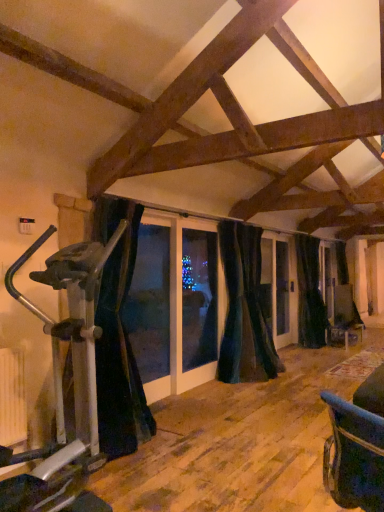
The width and height of the screenshot is (384, 512). In order to click on dark velvet curtain at center, which is the second curtain from right to left in this screenshot , I will do `click(244, 309)`.

What do you see at coordinates (61, 384) in the screenshot? Image resolution: width=384 pixels, height=512 pixels. I see `silver metallic stationary bicycle at left` at bounding box center [61, 384].

At what (x,y) coordinates should I click in order to perform the action: click on black velvet curtain at right, the first curtain from the right. Please return your answer as a coordinate pair (x, y). This screenshot has width=384, height=512. Looking at the image, I should click on (310, 294).

Does point (44, 473) come behind point (250, 312)?

No, (44, 473) is in front of (250, 312).

Is silver metallic stationary bicycle at left taller than dark velvet curtain at center, the second curtain viewed from the left?

In fact, silver metallic stationary bicycle at left may be shorter than dark velvet curtain at center, the second curtain viewed from the left.

From a real-world perspective, which object stands above the other?

dark velvet curtain at center, the second curtain viewed from the left, is physically above.

From the image's perspective, is silver metallic stationary bicycle at left above dark velvet curtain at center, which is the second curtain from right to left?

No, from the image's perspective, silver metallic stationary bicycle at left is not above dark velvet curtain at center, which is the second curtain from right to left.

I want to click on the 1st curtain in front of the black velvet curtain at right, the first curtain from the right, counting from the anchor's position, so click(x=244, y=309).

Can you confirm if dark velvet curtain at center, the second curtain in the back-to-front sequence, is taller than black velvet curtain at right, the 3th curtain positioned from the left?

In fact, dark velvet curtain at center, the second curtain in the back-to-front sequence, may be shorter than black velvet curtain at right, the 3th curtain positioned from the left.

Which object is wider, dark velvet curtain at center, the second curtain in the back-to-front sequence, or black velvet curtain at right, the first curtain from the right?

With larger width is dark velvet curtain at center, the second curtain in the back-to-front sequence.

Is dark velvet curtain at center, which is the second curtain from right to left, in front of or behind black velvet curtain at right, the 3th curtain positioned from the left, in the image?

Clearly, dark velvet curtain at center, which is the second curtain from right to left, is in front of black velvet curtain at right, the 3th curtain positioned from the left.

Is dark velvet curtain at center, the second curtain viewed from the front, at the left side of black fabric curtain at left, positioned as the third curtain in right-to-left order?

Incorrect, dark velvet curtain at center, the second curtain viewed from the front, is not on the left side of black fabric curtain at left, positioned as the third curtain in right-to-left order.

In terms of height, does dark velvet curtain at center, the second curtain in the back-to-front sequence, look taller or shorter compared to black fabric curtain at left, positioned as the third curtain in right-to-left order?

In the image, dark velvet curtain at center, the second curtain in the back-to-front sequence, appears to be shorter than black fabric curtain at left, positioned as the third curtain in right-to-left order.

In terms of width, does dark velvet curtain at center, the second curtain viewed from the left, look wider or thinner when compared to black fabric curtain at left, placed as the 1th curtain when sorted from left to right?

Considering their sizes, dark velvet curtain at center, the second curtain viewed from the left, looks slimmer than black fabric curtain at left, placed as the 1th curtain when sorted from left to right.

Can you tell me how much dark velvet curtain at center, the second curtain in the back-to-front sequence, and black fabric curtain at left, positioned as the third curtain in right-to-left order, differ in facing direction?

1.27e-05 degrees separate the facing orientations of dark velvet curtain at center, the second curtain in the back-to-front sequence, and black fabric curtain at left, positioned as the third curtain in right-to-left order.

Looking at the image, does black velvet curtain at right, the 3th curtain positioned from the left, seem bigger or smaller compared to silver metallic stationary bicycle at left?

black velvet curtain at right, the 3th curtain positioned from the left, is smaller than silver metallic stationary bicycle at left.

Is black velvet curtain at right, the first curtain positioned from the back, facing away from silver metallic stationary bicycle at left?

No, black velvet curtain at right, the first curtain positioned from the back,'s orientation is not away from silver metallic stationary bicycle at left.

Is black velvet curtain at right, the 3th curtain positioned from the left, shorter than silver metallic stationary bicycle at left?

In fact, black velvet curtain at right, the 3th curtain positioned from the left, may be taller than silver metallic stationary bicycle at left.

Is black velvet curtain at right, the third curtain when ordered from front to back, far away from silver metallic stationary bicycle at left?

Yes, black velvet curtain at right, the third curtain when ordered from front to back, is far from silver metallic stationary bicycle at left.

How much distance is there between black fabric curtain at left, which appears as the first curtain when viewed from the front, and silver metallic stationary bicycle at left?

The distance of black fabric curtain at left, which appears as the first curtain when viewed from the front, from silver metallic stationary bicycle at left is 23.32 inches.

Is black fabric curtain at left, the 3th curtain in the back-to-front sequence, positioned before silver metallic stationary bicycle at left?

No, it is not.

From a real-world perspective, is black fabric curtain at left, which appears as the first curtain when viewed from the front, over silver metallic stationary bicycle at left?

Yes.

Can you confirm if black fabric curtain at left, positioned as the third curtain in right-to-left order, is wider than silver metallic stationary bicycle at left?

No, black fabric curtain at left, positioned as the third curtain in right-to-left order, is not wider than silver metallic stationary bicycle at left.

Between silver metallic stationary bicycle at left and black fabric curtain at left, positioned as the third curtain in right-to-left order, which one appears on the right side from the viewer's perspective?

From the viewer's perspective, black fabric curtain at left, positioned as the third curtain in right-to-left order, appears more on the right side.

Is point (124, 228) closer or farther from the camera than point (122, 410)?

Point (124, 228) appears to be closer to the viewer than point (122, 410).

From a real-world perspective, relative to black fabric curtain at left, which appears as the first curtain when viewed from the front, is silver metallic stationary bicycle at left vertically above or below?

Clearly, from a real-world perspective, silver metallic stationary bicycle at left is below black fabric curtain at left, which appears as the first curtain when viewed from the front.

From the image's perspective, is silver metallic stationary bicycle at left located above or below black fabric curtain at left, which appears as the first curtain when viewed from the front?

silver metallic stationary bicycle at left is situated lower than black fabric curtain at left, which appears as the first curtain when viewed from the front, in the image.

Consider the image. Does silver metallic stationary bicycle at left have a lesser height compared to black velvet curtain at right, the first curtain positioned from the back?

Correct, silver metallic stationary bicycle at left is not as tall as black velvet curtain at right, the first curtain positioned from the back.

From the image's perspective, which object appears higher, silver metallic stationary bicycle at left or black velvet curtain at right, the third curtain when ordered from front to back?

black velvet curtain at right, the third curtain when ordered from front to back, from the image's perspective.

Could you measure the distance between silver metallic stationary bicycle at left and black velvet curtain at right, the first curtain positioned from the back?

The distance of silver metallic stationary bicycle at left from black velvet curtain at right, the first curtain positioned from the back, is 4.35 meters.

From a real-world perspective, is silver metallic stationary bicycle at left below black velvet curtain at right, the 3th curtain positioned from the left?

Indeed, from a real-world perspective, silver metallic stationary bicycle at left is positioned beneath black velvet curtain at right, the 3th curtain positioned from the left.

Identify the location of stationary bicycle that appears in front of the dark velvet curtain at center, the second curtain in the back-to-front sequence. The width and height of the screenshot is (384, 512). (61, 384).

At what (x,y) coordinates should I click in order to perform the action: click on curtain lying on the right of dark velvet curtain at center, the second curtain in the back-to-front sequence. Please return your answer as a coordinate pair (x, y). Image resolution: width=384 pixels, height=512 pixels. Looking at the image, I should click on (310, 294).

Considering their positions, is black fabric curtain at left, positioned as the third curtain in right-to-left order, positioned further to dark velvet curtain at center, the second curtain viewed from the left, than black velvet curtain at right, the first curtain from the right?

black fabric curtain at left, positioned as the third curtain in right-to-left order.

When comparing their distances from black velvet curtain at right, the 3th curtain positioned from the left, does dark velvet curtain at center, the second curtain viewed from the front, or black fabric curtain at left, positioned as the third curtain in right-to-left order, seem closer?

dark velvet curtain at center, the second curtain viewed from the front, is positioned closer to the anchor black velvet curtain at right, the 3th curtain positioned from the left.

Consider the image. Estimate the real-world distances between objects in this image. Which object is further from silver metallic stationary bicycle at left, black fabric curtain at left, the 3th curtain in the back-to-front sequence, or black velvet curtain at right, the 3th curtain positioned from the left?

black velvet curtain at right, the 3th curtain positioned from the left, lies further to silver metallic stationary bicycle at left than the other object.

Looking at the image, which one is located further to dark velvet curtain at center, the second curtain viewed from the front, silver metallic stationary bicycle at left or black fabric curtain at left, placed as the 1th curtain when sorted from left to right?

Among the two, silver metallic stationary bicycle at left is located further to dark velvet curtain at center, the second curtain viewed from the front.

When comparing their distances from black velvet curtain at right, the third curtain when ordered from front to back, does black fabric curtain at left, which appears as the first curtain when viewed from the front, or dark velvet curtain at center, which is the second curtain from right to left, seem further?

Based on the image, black fabric curtain at left, which appears as the first curtain when viewed from the front, appears to be further to black velvet curtain at right, the third curtain when ordered from front to back.

From the image, which object appears to be farther from black velvet curtain at right, the first curtain positioned from the back, black fabric curtain at left, placed as the 1th curtain when sorted from left to right, or silver metallic stationary bicycle at left?

silver metallic stationary bicycle at left lies further to black velvet curtain at right, the first curtain positioned from the back, than the other object.

Based on their spatial positions, is silver metallic stationary bicycle at left or black velvet curtain at right, the third curtain when ordered from front to back, closer to dark velvet curtain at center, the second curtain viewed from the front?

black velvet curtain at right, the third curtain when ordered from front to back, lies closer to dark velvet curtain at center, the second curtain viewed from the front, than the other object.

Looking at the image, which one is located further to silver metallic stationary bicycle at left, dark velvet curtain at center, the second curtain viewed from the left, or black velvet curtain at right, the first curtain from the right?

The object further to silver metallic stationary bicycle at left is black velvet curtain at right, the first curtain from the right.

The height and width of the screenshot is (512, 384). Identify the location of curtain between silver metallic stationary bicycle at left and dark velvet curtain at center, the second curtain in the back-to-front sequence, in the front-back direction. (118, 335).

Identify the location of curtain between black fabric curtain at left, positioned as the third curtain in right-to-left order, and black velvet curtain at right, the 3th curtain positioned from the left, in the front-back direction. The image size is (384, 512). (244, 309).